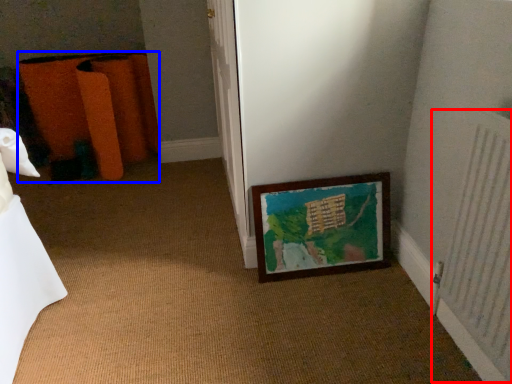
Question: Which object is further to the camera taking this photo, radiator (highlighted by a red box) or furniture (highlighted by a blue box)?

Choices:
 (A) radiator
 (B) furniture

Answer: (B)